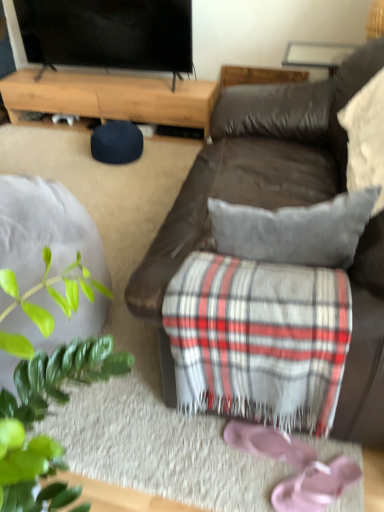
Identify the location of brown leather couch at center. The image size is (384, 512). (249, 182).

Identify the location of pink fabric flip-flops at lower right. (316, 485).

What do you see at coordinates (111, 97) in the screenshot? I see `light brown wood at upper left` at bounding box center [111, 97].

Measure the distance between light brown wood at upper left and camera.

A distance of 8.14 feet exists between light brown wood at upper left and camera.

The height and width of the screenshot is (512, 384). Describe the element at coordinates (269, 443) in the screenshot. I see `pink suede shoe at lower center` at that location.

What are the coordinates of `brown leather couch at center` in the screenshot? It's located at (249, 182).

Is light brown wood at upper left next to pink fabric flip-flops at lower right?

No, light brown wood at upper left is not next to pink fabric flip-flops at lower right.

Who is shorter, light brown wood at upper left or pink fabric flip-flops at lower right?

Standing shorter between the two is pink fabric flip-flops at lower right.

Considering the positions of point (178, 120) and point (352, 477), is point (178, 120) closer or farther from the camera than point (352, 477)?

Point (178, 120) appears to be farther away from the viewer than point (352, 477).

Is the depth of light brown wood at upper left greater than that of pink fabric flip-flops at lower right?

Yes.

Is flat screen tv at upper left facing towards pink fabric flip-flops at lower right?

Yes, flat screen tv at upper left is facing pink fabric flip-flops at lower right.

Consider the image. From a real-world perspective, who is located lower, flat screen tv at upper left or pink fabric flip-flops at lower right?

From a 3D spatial view, pink fabric flip-flops at lower right is below.

From the image's perspective, which object appears higher, flat screen tv at upper left or pink fabric flip-flops at lower right?

flat screen tv at upper left.

Between white textured pillow at upper right and pink suede shoe at lower center, which one has smaller size?

pink suede shoe at lower center is smaller.

In the scene shown: Considering the sizes of objects white textured pillow at upper right and pink suede shoe at lower center in the image provided, who is wider, white textured pillow at upper right or pink suede shoe at lower center?

With larger width is pink suede shoe at lower center.

From the image's perspective, is white textured pillow at upper right above pink suede shoe at lower center?

Yes, from the image's perspective, white textured pillow at upper right is over pink suede shoe at lower center.

Between white textured pillow at upper right and pink suede shoe at lower center, which one is positioned behind?

pink suede shoe at lower center is more distant.

You are a GUI agent. You are given a task and a screenshot of the screen. Output one action in this format:
    pyautogui.click(x=<x>, y=<y>)
    Task: Click on the footwear below the flat screen tv at upper left (from a real-world perspective)
    The height and width of the screenshot is (512, 384).
    Given the screenshot: What is the action you would take?
    click(x=316, y=485)

From the image's perspective, which is above, pink fabric flip-flops at lower right or flat screen tv at upper left?

From the image's view, flat screen tv at upper left is above.

In the scene shown: Is pink fabric flip-flops at lower right taller than flat screen tv at upper left?

No, pink fabric flip-flops at lower right is not taller than flat screen tv at upper left.

Where is `studio couch that appears in front of the pink suede shoe at lower center`? studio couch that appears in front of the pink suede shoe at lower center is located at coordinates (249, 182).

Does brown leather couch at center have a greater height compared to pink suede shoe at lower center?

Yes.

Between brown leather couch at center and pink suede shoe at lower center, which one has smaller width?

pink suede shoe at lower center.

How distant is brown leather couch at center from pink suede shoe at lower center?

29.09 inches.

Is flat screen tv at upper left far from brown leather couch at center?

That's right, there is a large distance between flat screen tv at upper left and brown leather couch at center.

What's the angular difference between flat screen tv at upper left and brown leather couch at center's facing directions?

The angle between the facing direction of flat screen tv at upper left and the facing direction of brown leather couch at center is 88.4 degrees.

Is flat screen tv at upper left outside of brown leather couch at center?

Yes, flat screen tv at upper left is not within brown leather couch at center.

From a real-world perspective, is pink suede shoe at lower center positioned above or below brown leather couch at center?

Clearly, from a real-world perspective, pink suede shoe at lower center is below brown leather couch at center.

Is pink suede shoe at lower center bigger than brown leather couch at center?

Incorrect, pink suede shoe at lower center is not larger than brown leather couch at center.

From the picture: In terms of height, does pink suede shoe at lower center look taller or shorter compared to brown leather couch at center?

Considering their sizes, pink suede shoe at lower center has less height than brown leather couch at center.

Is pink suede shoe at lower center aimed at brown leather couch at center?

No, pink suede shoe at lower center is not turned towards brown leather couch at center.

At what (x,y) coordinates should I click in order to perform the action: click on desk located above the pink fabric flip-flops at lower right (from a real-world perspective). Please return your answer as a coordinate pair (x, y). This screenshot has height=512, width=384. Looking at the image, I should click on (111, 97).

Locate an element on the screen. footwear on the right of the flat screen tv at upper left is located at coordinates (316, 485).

From the image, which object appears to be farther from flat screen tv at upper left, white textured pillow at upper right or pink fabric flip-flops at lower right?

Based on the image, pink fabric flip-flops at lower right appears to be further to flat screen tv at upper left.

Estimate the real-world distances between objects in this image. Which object is closer to light brown wood at upper left, white textured pillow at upper right or flat screen tv at upper left?

flat screen tv at upper left.

Considering their positions, is brown leather couch at center positioned further to white textured pillow at upper right than light brown wood at upper left?

light brown wood at upper left.

Which object lies further to the anchor point brown leather couch at center, flat screen tv at upper left or light brown wood at upper left?

flat screen tv at upper left is positioned further to the anchor brown leather couch at center.

Which object lies further to the anchor point white textured pillow at upper right, pink fabric flip-flops at lower right or light brown wood at upper left?

light brown wood at upper left is positioned further to the anchor white textured pillow at upper right.

Based on their spatial positions, is brown leather couch at center or pink fabric flip-flops at lower right closer to flat screen tv at upper left?

brown leather couch at center is positioned closer to the anchor flat screen tv at upper left.

Which object lies further to the anchor point light brown wood at upper left, pink fabric flip-flops at lower right or flat screen tv at upper left?

Among the two, pink fabric flip-flops at lower right is located further to light brown wood at upper left.

Estimate the real-world distances between objects in this image. Which object is further from pink fabric flip-flops at lower right, flat screen tv at upper left or brown leather couch at center?

flat screen tv at upper left.

The width and height of the screenshot is (384, 512). In order to click on television between brown leather couch at center and light brown wood at upper left from front to back in this screenshot , I will do point(108,33).

I want to click on studio couch between flat screen tv at upper left and pink suede shoe at lower center vertically, so click(249, 182).

You are a GUI agent. You are given a task and a screenshot of the screen. Output one action in this format:
    pyautogui.click(x=<x>, y=<y>)
    Task: Click on the pillow between brown leather couch at center and light brown wood at upper left from front to back
    
    Given the screenshot: What is the action you would take?
    pyautogui.click(x=365, y=138)

Image resolution: width=384 pixels, height=512 pixels. Find the location of `shoe between brown leather couch at center and pink fabric flip-flops at lower right from top to bottom`. shoe between brown leather couch at center and pink fabric flip-flops at lower right from top to bottom is located at coordinates (269, 443).